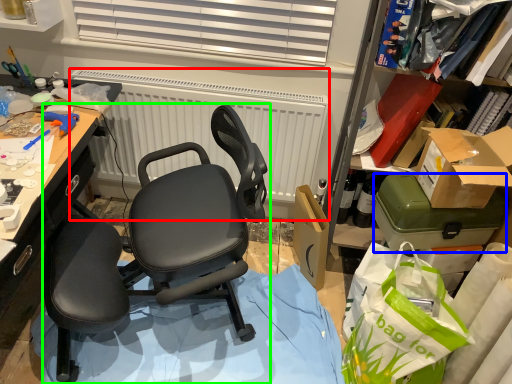
Question: Based on their relative distances, which object is farther from radiator (highlighted by a red box)? Choose from box (highlighted by a blue box) and chair (highlighted by a green box).

Choices:
 (A) box
 (B) chair

Answer: (A)